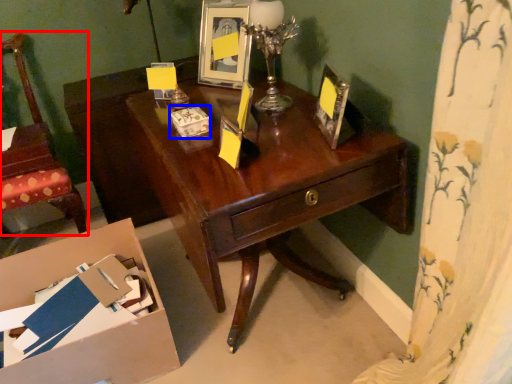
Question: Which of the following is the closest to the observer, chair (highlighted by a red box) or box (highlighted by a blue box)?

Choices:
 (A) chair
 (B) box

Answer: (B)